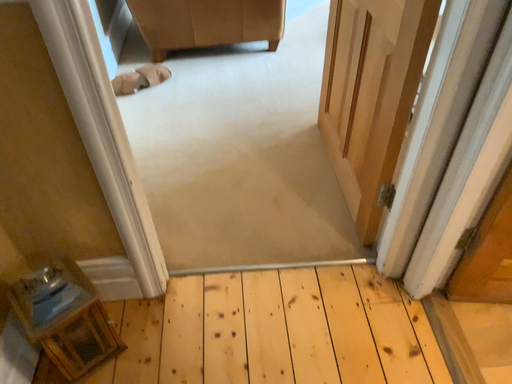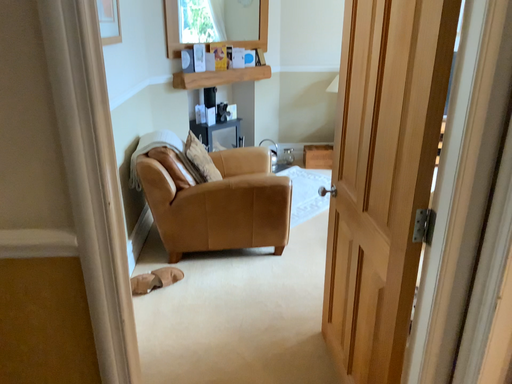
Question: Which way did the camera rotate in the video?

Choices:
 (A) rotated upward
 (B) rotated downward

Answer: (A)